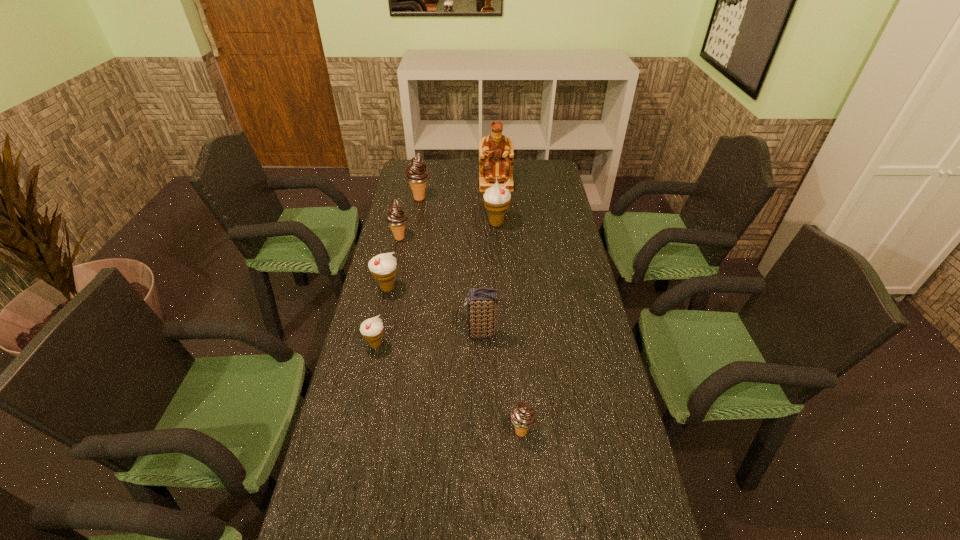
Identify the location of vacant region between the fifth farthest icecream and the biggest chocolate icecream. (397, 272).

Find the location of `free space between the biggest chocolate icecream and the figurine`. free space between the biggest chocolate icecream and the figurine is located at coordinates (458, 191).

Identify which object is the seventh nearest to the smallest white icecream. Please provide its 2D coordinates. Your answer should be formatted as a tuple, i.e. [(x, y)], where the tuple contains the x and y coordinates of a point satisfying the conditions above.

[(496, 156)]

Identify which object is the seventh closest to the tallest object. Please provide its 2D coordinates. Your answer should be formatted as a tuple, i.e. [(x, y)], where the tuple contains the x and y coordinates of a point satisfying the conditions above.

[(522, 416)]

Locate which icecream is the closest to the smallest chocolate icecream. Please provide its 2D coordinates. Your answer should be formatted as a tuple, i.e. [(x, y)], where the tuple contains the x and y coordinates of a point satisfying the conditions above.

[(372, 329)]

Locate an element on the screen. The height and width of the screenshot is (540, 960). icecream that stands as the sixth closest to the clutch bag is located at coordinates (417, 174).

Select which white icecream appears as the second closest to the farthest icecream. Please provide its 2D coordinates. Your answer should be formatted as a tuple, i.e. [(x, y)], where the tuple contains the x and y coordinates of a point satisfying the conditions above.

[(383, 267)]

Identify which white icecream is the third closest to the figurine. Please provide its 2D coordinates. Your answer should be formatted as a tuple, i.e. [(x, y)], where the tuple contains the x and y coordinates of a point satisfying the conditions above.

[(372, 329)]

You are a GUI agent. You are given a task and a screenshot of the screen. Output one action in this format:
    pyautogui.click(x=<x>, y=<y>)
    Task: Click on the chocolate icecream that is the second nearest to the biggest white icecream
    
    Given the screenshot: What is the action you would take?
    coord(396,218)

At what (x,y) coordinates should I click in order to perform the action: click on chocolate icecream that stands as the second closest to the clutch bag. Please return your answer as a coordinate pair (x, y). Looking at the image, I should click on (396, 218).